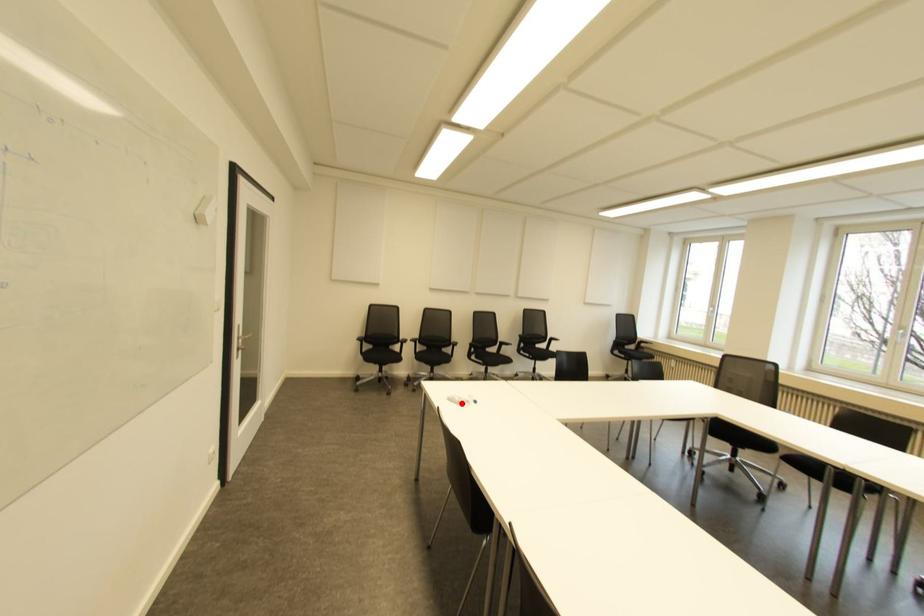
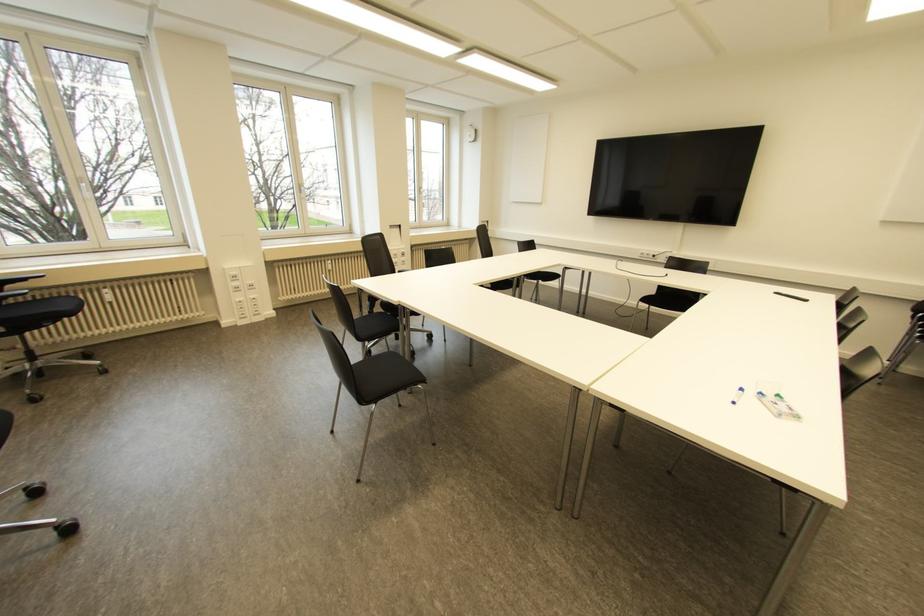
Find the pixel in the second image that matches the highlighted location in the first image.

(777, 395)